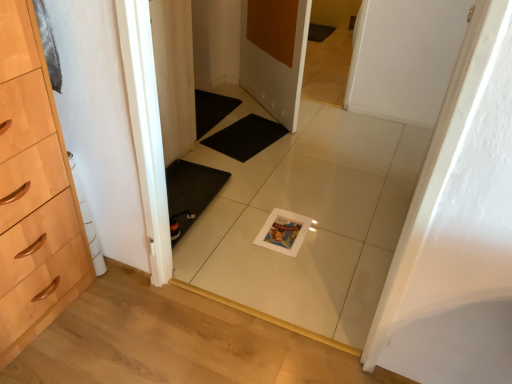
Question: Considering the relative positions of matte white door at center, which is the second door in front-to-back order, and white matte door at center, the 2th door when ordered from back to front, in the image provided, is matte white door at center, which is the second door in front-to-back order, to the right of white matte door at center, the 2th door when ordered from back to front, from the viewer's perspective?

Choices:
 (A) yes
 (B) no

Answer: (B)

Question: From the image's perspective, is matte white door at center, the 2th door from the right, located beneath white matte door at center, the 2th door from the left?

Choices:
 (A) yes
 (B) no

Answer: (B)

Question: Are matte white door at center, which is counted as the first door, starting from the left, and white matte door at center, arranged as the 1th door when viewed from the front, located far from each other?

Choices:
 (A) yes
 (B) no

Answer: (A)

Question: Is matte white door at center, which is the second door in front-to-back order, wider than white matte door at center, the 2th door from the left?

Choices:
 (A) no
 (B) yes

Answer: (B)

Question: Considering the relative sizes of matte white door at center, the 2th door from the right, and white matte door at center, the 2th door from the left, in the image provided, is matte white door at center, the 2th door from the right, smaller than white matte door at center, the 2th door from the left,?

Choices:
 (A) yes
 (B) no

Answer: (A)

Question: From a real-world perspective, is matte white door at center, which is counted as the first door, starting from the left, located beneath white matte door at center, arranged as the 1th door when viewed from the front?

Choices:
 (A) no
 (B) yes

Answer: (B)

Question: Is matte white door at center, which is the second door in front-to-back order, turned away from white glossy tile at center?

Choices:
 (A) yes
 (B) no

Answer: (B)

Question: Is matte white door at center, the 2th door from the right, aimed at white glossy tile at center?

Choices:
 (A) no
 (B) yes

Answer: (A)

Question: Does matte white door at center, the 2th door from the right, appear on the right side of white glossy tile at center?

Choices:
 (A) no
 (B) yes

Answer: (B)

Question: Can you confirm if matte white door at center, which is counted as the first door, starting from the back, is wider than white glossy tile at center?

Choices:
 (A) yes
 (B) no

Answer: (A)

Question: Is white glossy tile at center located within matte white door at center, which is the second door in front-to-back order?

Choices:
 (A) yes
 (B) no

Answer: (B)

Question: Is matte white door at center, which is counted as the first door, starting from the back, at the left side of white glossy tile at center?

Choices:
 (A) no
 (B) yes

Answer: (A)

Question: Does black rubber bath mat at center appear on the left side of white glossy tile at center?

Choices:
 (A) no
 (B) yes

Answer: (B)